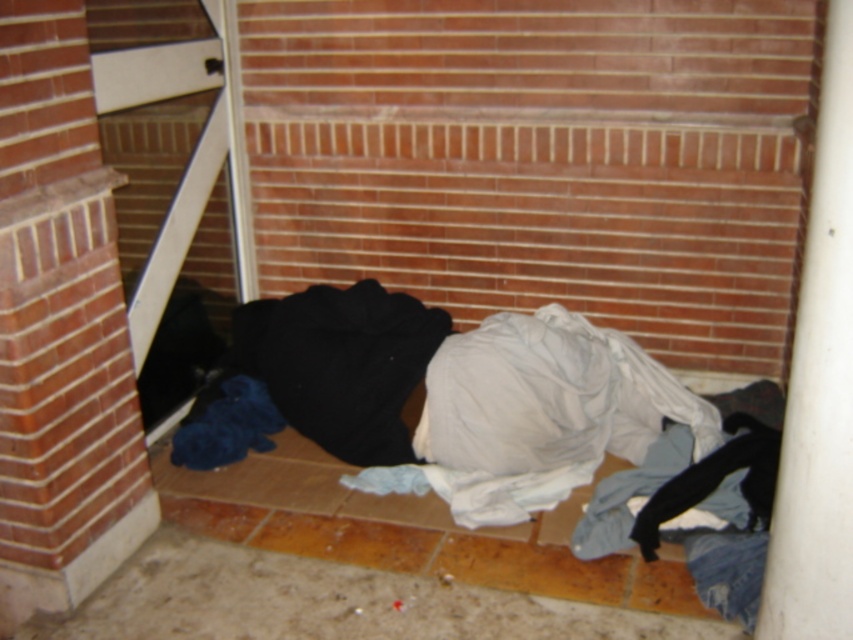
Question: Is the position of white cotton laundry at center more distant than that of black fuzzy blanket at center?

Choices:
 (A) no
 (B) yes

Answer: (A)

Question: Which object is farther from the camera taking this photo?

Choices:
 (A) white cotton laundry at center
 (B) black fuzzy blanket at center

Answer: (B)

Question: Which of the following is the closest to the observer?

Choices:
 (A) (440, 330)
 (B) (776, 636)
 (C) (514, 356)

Answer: (B)

Question: Is white smooth pipe at right to the right of black fuzzy blanket at center from the viewer's perspective?

Choices:
 (A) yes
 (B) no

Answer: (A)

Question: Which object appears farthest from the camera in this image?

Choices:
 (A) white cotton laundry at center
 (B) white smooth pipe at right

Answer: (A)

Question: Does white cotton laundry at center appear over white smooth pipe at right?

Choices:
 (A) no
 (B) yes

Answer: (A)